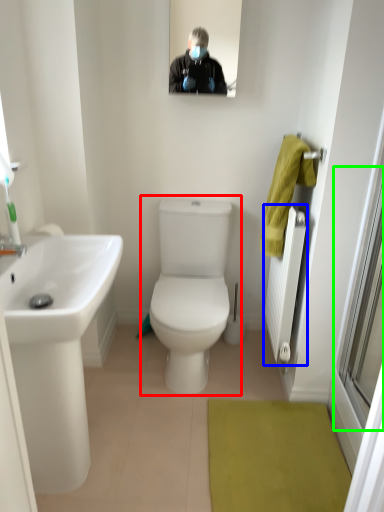
Question: Which object is positioned closest to toilet (highlighted by a red box)? Select from radiator (highlighted by a blue box) and window screen (highlighted by a green box).

Choices:
 (A) radiator
 (B) window screen

Answer: (A)